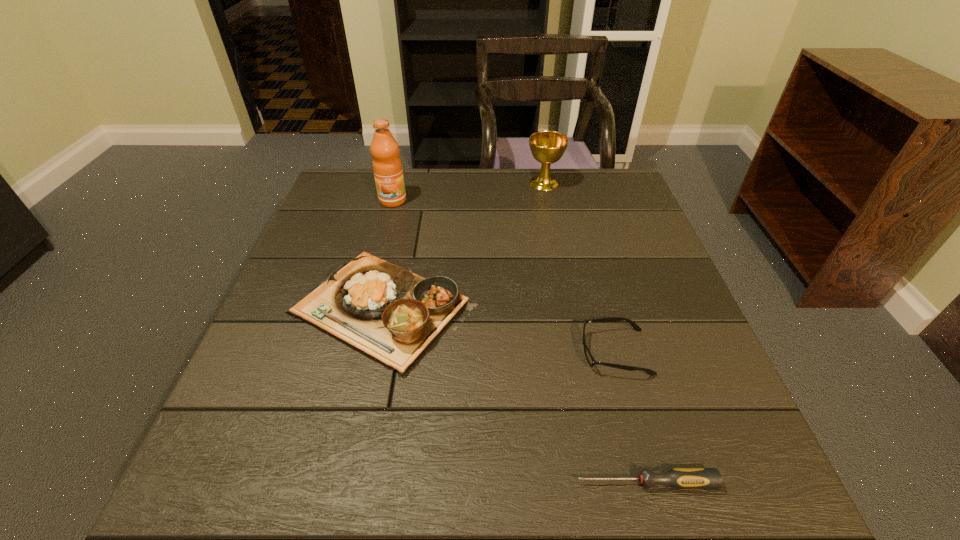
Image resolution: width=960 pixels, height=540 pixels. I want to click on fruit juice, so click(387, 166).

The height and width of the screenshot is (540, 960). In order to click on the second farthest object in this screenshot , I will do `click(387, 166)`.

This screenshot has width=960, height=540. What are the coordinates of `chalice` in the screenshot? It's located at (547, 147).

The width and height of the screenshot is (960, 540). Identify the location of the farthest object. (547, 147).

Locate an element on the screen. the third tallest object is located at coordinates (393, 315).

Identify the location of the second shortest object. (591, 361).

Find the location of a particular element. The height and width of the screenshot is (540, 960). screwdriver is located at coordinates (678, 478).

This screenshot has height=540, width=960. I want to click on the nearest object, so click(x=678, y=478).

The image size is (960, 540). I want to click on vacant region located on the label side of the fruit juice, so click(x=367, y=301).

Find the location of `vacant space located on the left of the fourth shortest object`. vacant space located on the left of the fourth shortest object is located at coordinates (452, 183).